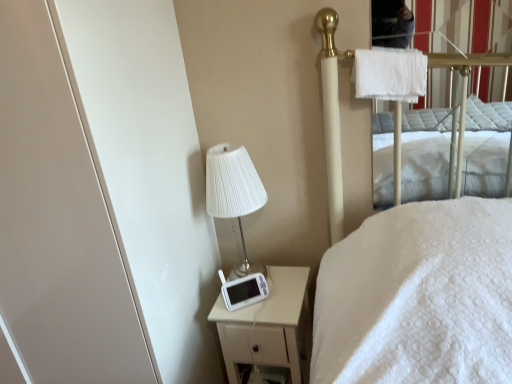
Measure the distance between white pleated fabric lampshade at upper left and camera.

The distance of white pleated fabric lampshade at upper left from camera is 4.60 feet.

This screenshot has width=512, height=384. What do you see at coordinates (390, 74) in the screenshot?
I see `white fluffy towel at upper right` at bounding box center [390, 74].

In order to face white fluffy towel at upper right, should I rotate leftwards or rightwards?

It's best to rotate right around 17.738 degrees.

Locate an element on the screen. Image resolution: width=512 pixels, height=384 pixels. white pleated fabric lampshade at upper left is located at coordinates pyautogui.click(x=234, y=193).

Is white matte nightstand at lower right not within white glossy screen door at left?

Yes, white matte nightstand at lower right is outside of white glossy screen door at left.

From the picture: Considering the relative positions of white matte nightstand at lower right and white glossy screen door at left in the image provided, is white matte nightstand at lower right behind white glossy screen door at left?

Yes, white matte nightstand at lower right is further from the viewer.

Considering the points (276, 298) and (62, 219), which point is behind, point (276, 298) or point (62, 219)?

The point (276, 298) is behind.

Is white matte nightstand at lower right wider or thinner than white glossy screen door at left?

In the image, white matte nightstand at lower right appears to be more narrow than white glossy screen door at left.

Considering the relative positions of white fluffy towel at upper right and white matte nightstand at lower right in the image provided, is white fluffy towel at upper right to the right of white matte nightstand at lower right from the viewer's perspective?

Indeed, white fluffy towel at upper right is positioned on the right side of white matte nightstand at lower right.

Considering the sizes of objects white fluffy towel at upper right and white matte nightstand at lower right in the image provided, who is bigger, white fluffy towel at upper right or white matte nightstand at lower right?

With larger size is white matte nightstand at lower right.

Does point (401, 51) come farther from viewer compared to point (300, 316)?

That is False.

From the picture: Relative to white matte nightstand at lower right, is white fluffy towel at upper right in front or behind?

Clearly, white fluffy towel at upper right is in front of white matte nightstand at lower right.

Looking at this image, considering the relative sizes of white glossy screen door at left and white fluffy towel at upper right in the image provided, is white glossy screen door at left thinner than white fluffy towel at upper right?

No.

Considering the sizes of white glossy screen door at left and white fluffy towel at upper right in the image, is white glossy screen door at left bigger or smaller than white fluffy towel at upper right?

Considering their sizes, white glossy screen door at left takes up more space than white fluffy towel at upper right.

Would you say white glossy screen door at left is inside or outside white fluffy towel at upper right?

white glossy screen door at left is spatially situated outside white fluffy towel at upper right.

Is white glossy screen door at left to the left or to the right of white fluffy towel at upper right in the image?

Based on their positions, white glossy screen door at left is located to the left of white fluffy towel at upper right.

Does white pleated fabric lampshade at upper left turn towards white glossy screen door at left?

No, white pleated fabric lampshade at upper left is not turned towards white glossy screen door at left.

Is white pleated fabric lampshade at upper left wider than white glossy screen door at left?

Incorrect, the width of white pleated fabric lampshade at upper left does not surpass that of white glossy screen door at left.

Which object is more forward, white pleated fabric lampshade at upper left or white glossy screen door at left?

Positioned in front is white glossy screen door at left.

From the image's perspective, is white pleated fabric lampshade at upper left beneath white glossy screen door at left?

Incorrect, from the image's perspective, white pleated fabric lampshade at upper left is higher than white glossy screen door at left.

Could you tell me if white matte nightstand at lower right is facing white fluffy towel at upper right?

No, white matte nightstand at lower right does not turn towards white fluffy towel at upper right.

Locate an element on the screen. nightstand to the left of white fluffy towel at upper right is located at coordinates (x=268, y=326).

From the image's perspective, who appears lower, white matte nightstand at lower right or white fluffy towel at upper right?

white matte nightstand at lower right.

In the image, is white matte nightstand at lower right positioned in front of or behind white fluffy towel at upper right?

Clearly, white matte nightstand at lower right is behind white fluffy towel at upper right.

Which object is positioned more to the right, white pleated fabric lampshade at upper left or white fluffy towel at upper right?

white fluffy towel at upper right.

Considering the sizes of objects white pleated fabric lampshade at upper left and white fluffy towel at upper right in the image provided, who is bigger, white pleated fabric lampshade at upper left or white fluffy towel at upper right?

white pleated fabric lampshade at upper left is bigger.

From the image's perspective, is white pleated fabric lampshade at upper left positioned above or below white fluffy towel at upper right?

Clearly, from the image's perspective, white pleated fabric lampshade at upper left is below white fluffy towel at upper right.

From a real-world perspective, between white pleated fabric lampshade at upper left and white fluffy towel at upper right, who is vertically higher?

white fluffy towel at upper right, from a real-world perspective.

Based on the photo, what's the angular difference between white glossy screen door at left and white matte nightstand at lower right's facing directions?

The angular difference between white glossy screen door at left and white matte nightstand at lower right is 1.21 degrees.

From the image's perspective, is white glossy screen door at left above white matte nightstand at lower right?

Yes.

Does white glossy screen door at left touch white matte nightstand at lower right?

No, white glossy screen door at left is not next to white matte nightstand at lower right.

From a real-world perspective, is white glossy screen door at left above or below white matte nightstand at lower right?

From a real-world perspective, white glossy screen door at left is physically above white matte nightstand at lower right.

The width and height of the screenshot is (512, 384). Find the location of `nightstand lying behind the white glossy screen door at left`. nightstand lying behind the white glossy screen door at left is located at coordinates (268, 326).

Find the location of a particular element. The height and width of the screenshot is (384, 512). cloth that is above the white matte nightstand at lower right (from a real-world perspective) is located at coordinates (390, 74).

Looking at the image, which one is located closer to white pleated fabric lampshade at upper left, white fluffy towel at upper right or white glossy screen door at left?

Based on the image, white glossy screen door at left appears to be nearer to white pleated fabric lampshade at upper left.

Which object lies further to the anchor point white fluffy towel at upper right, white pleated fabric lampshade at upper left or white matte nightstand at lower right?

white matte nightstand at lower right lies further to white fluffy towel at upper right than the other object.

Which object lies further to the anchor point white fluffy towel at upper right, white glossy screen door at left or white matte nightstand at lower right?

white glossy screen door at left.

Based on their spatial positions, is white pleated fabric lampshade at upper left or white fluffy towel at upper right closer to white matte nightstand at lower right?

Based on the image, white pleated fabric lampshade at upper left appears to be nearer to white matte nightstand at lower right.

From the image, which object appears to be farther from white glossy screen door at left, white pleated fabric lampshade at upper left or white fluffy towel at upper right?

Based on the image, white fluffy towel at upper right appears to be further to white glossy screen door at left.

Based on their spatial positions, is white fluffy towel at upper right or white glossy screen door at left further from white matte nightstand at lower right?

white fluffy towel at upper right is further to white matte nightstand at lower right.

From the image, which object appears to be farther from white pleated fabric lampshade at upper left, white glossy screen door at left or white matte nightstand at lower right?

white glossy screen door at left lies further to white pleated fabric lampshade at upper left than the other object.

From the picture: From the image, which object appears to be farther from white pleated fabric lampshade at upper left, white matte nightstand at lower right or white glossy screen door at left?

white glossy screen door at left lies further to white pleated fabric lampshade at upper left than the other object.

Locate an element on the screen. table lamp located between white glossy screen door at left and white matte nightstand at lower right in the left-right direction is located at coordinates (234, 193).

Find the location of a particular element. The image size is (512, 384). table lamp between white fluffy towel at upper right and white matte nightstand at lower right from top to bottom is located at coordinates (234, 193).

The height and width of the screenshot is (384, 512). I want to click on nightstand situated between white glossy screen door at left and white fluffy towel at upper right from left to right, so click(x=268, y=326).

Where is `table lamp located between white glossy screen door at left and white fluffy towel at upper right in the left-right direction`? This screenshot has width=512, height=384. table lamp located between white glossy screen door at left and white fluffy towel at upper right in the left-right direction is located at coordinates (234, 193).